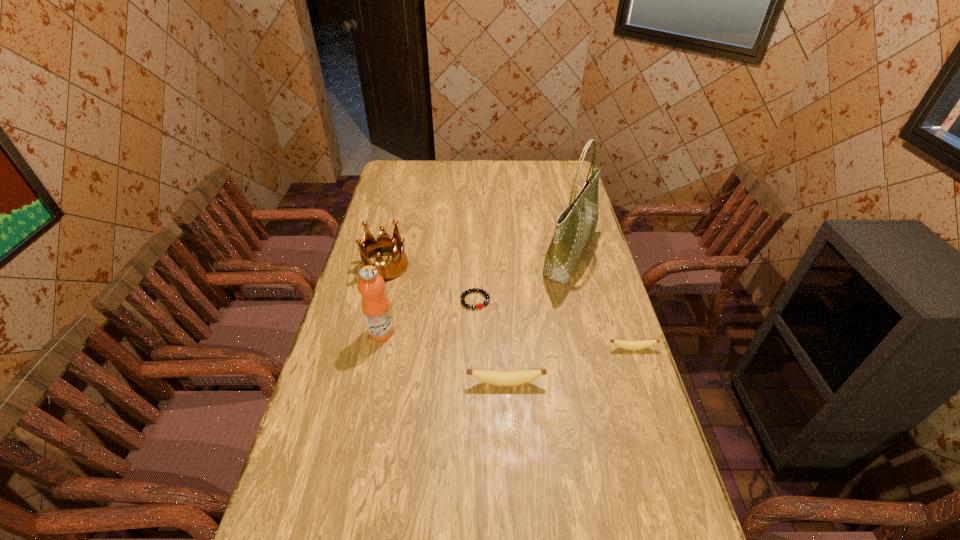
You are a GUI agent. You are given a task and a screenshot of the screen. Output one action in this format:
    pyautogui.click(x=<x>, y=<y>)
    Task: Click on the nearest object
    The width and height of the screenshot is (960, 540).
    Given the screenshot: What is the action you would take?
    pyautogui.click(x=495, y=377)

This screenshot has height=540, width=960. What are the coordinates of `the fourth tallest object` in the screenshot? It's located at (495, 377).

Find the location of a particular element. The height and width of the screenshot is (540, 960). the shorter banana is located at coordinates (626, 344).

The height and width of the screenshot is (540, 960). I want to click on the right banana, so click(x=626, y=344).

I want to click on the third farthest object, so click(485, 303).

At what (x,y) coordinates should I click in order to perform the action: click on the shortest object. Please return your answer as a coordinate pair (x, y). Looking at the image, I should click on (485, 303).

Identify the location of the fourth shortest object. (368, 247).

This screenshot has width=960, height=540. Find the location of `the tallest object`. the tallest object is located at coordinates (575, 227).

Image resolution: width=960 pixels, height=540 pixels. I want to click on the second tallest object, so click(x=376, y=309).

Identify the location of the fourth farthest object. [376, 309].